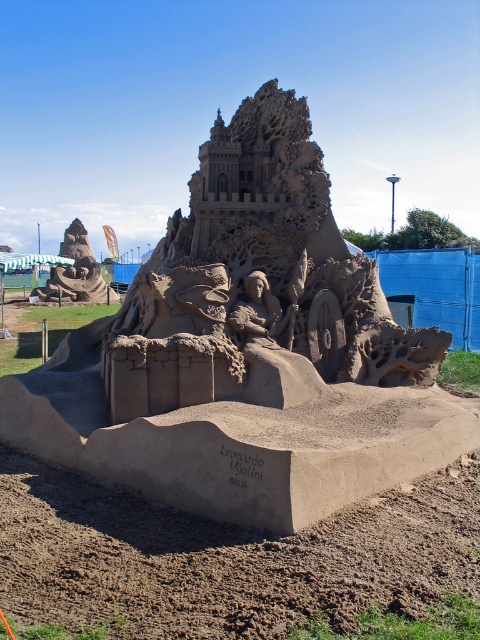
Is point (290, 244) positioned behind point (63, 276)?

No, it is in front of (63, 276).

Does point (147, 307) come in front of point (84, 228)?

Yes, point (147, 307) is in front of point (84, 228).

Between point (152, 404) and point (74, 253), which one is positioned in front?

Point (152, 404)

Locate an element on the screen. This screenshot has height=640, width=480. natural sand sandcastle at center is located at coordinates (248, 353).